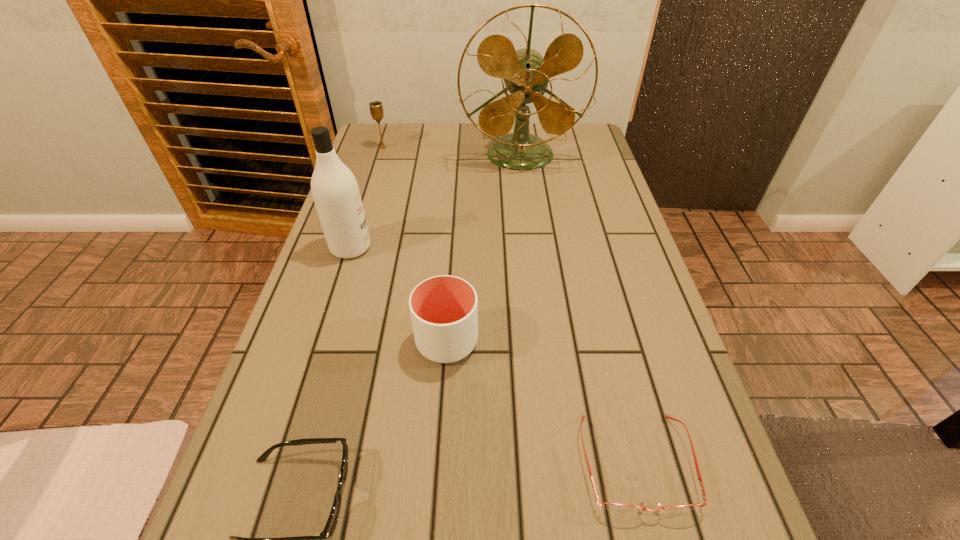
In the image, there is a desktop. In order to click on vacant region at the far edge in this screenshot , I will do `click(458, 146)`.

The width and height of the screenshot is (960, 540). I want to click on vacant space at the left edge, so click(x=323, y=305).

The height and width of the screenshot is (540, 960). Find the location of `free space at the right edge of the desktop`. free space at the right edge of the desktop is located at coordinates (622, 272).

Where is `free spot at the far left corner of the desktop`? This screenshot has height=540, width=960. free spot at the far left corner of the desktop is located at coordinates (405, 137).

In the image, there is a desktop. What are the coordinates of `vacant area at the far right corner` in the screenshot? It's located at (558, 137).

Identify the location of free spot between the fan and the chalice. The height and width of the screenshot is (540, 960). (451, 151).

Identify the location of free space between the fan and the chalice. Image resolution: width=960 pixels, height=540 pixels. (451, 151).

Find the location of a particular element. The height and width of the screenshot is (540, 960). free space that is in between the second tallest object and the chalice is located at coordinates (367, 198).

This screenshot has width=960, height=540. In order to click on blank region between the shorter spectacles and the fourth shortest object in this screenshot , I will do [510, 305].

You are a GUI agent. You are given a task and a screenshot of the screen. Output one action in this format:
    pyautogui.click(x=<x>, y=<y>)
    Task: Click on the free space between the fourth tallest object and the third tallest object
    This screenshot has height=540, width=960.
    Given the screenshot: What is the action you would take?
    pyautogui.click(x=415, y=244)